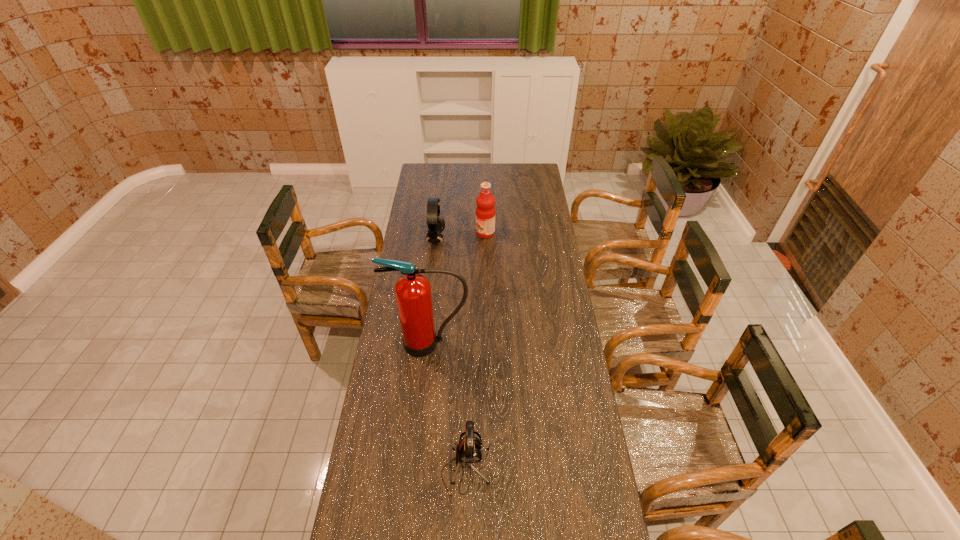
You are a GUI agent. You are given a task and a screenshot of the screen. Output one action in this format:
    pyautogui.click(x=<x>, y=<y>)
    Task: Click on the free space located on the ear cups of the left earphone
    
    Given the screenshot: What is the action you would take?
    pyautogui.click(x=470, y=240)

Locate an element on the screen. This screenshot has height=540, width=960. vacant space located 0.070m on the front of the right earphone is located at coordinates (465, 521).

Identify the location of fire extinguisher present at the left edge. point(413,294).

Find the location of a particular element. The height and width of the screenshot is (540, 960). earphone positioned at the left edge is located at coordinates (436, 224).

You are a GUI agent. You are given a task and a screenshot of the screen. Output one action in this format:
    pyautogui.click(x=<x>, y=<y>)
    Task: Click on the free space at the left edge of the desktop
    Image resolution: width=960 pixels, height=540 pixels.
    Given the screenshot: What is the action you would take?
    pyautogui.click(x=439, y=197)

Locate an element on the screen. Image resolution: width=960 pixels, height=540 pixels. vacant space at the right edge of the desktop is located at coordinates (528, 239).

Where is `vacant position at the far left corner of the desktop`? vacant position at the far left corner of the desktop is located at coordinates (438, 165).

The height and width of the screenshot is (540, 960). I want to click on vacant space at the far right corner, so click(527, 181).

I want to click on vacant point located between the nearest object and the second tallest object, so click(475, 352).

In order to click on vacant point located between the farther earphone and the third shortest object in this screenshot , I will do `click(461, 237)`.